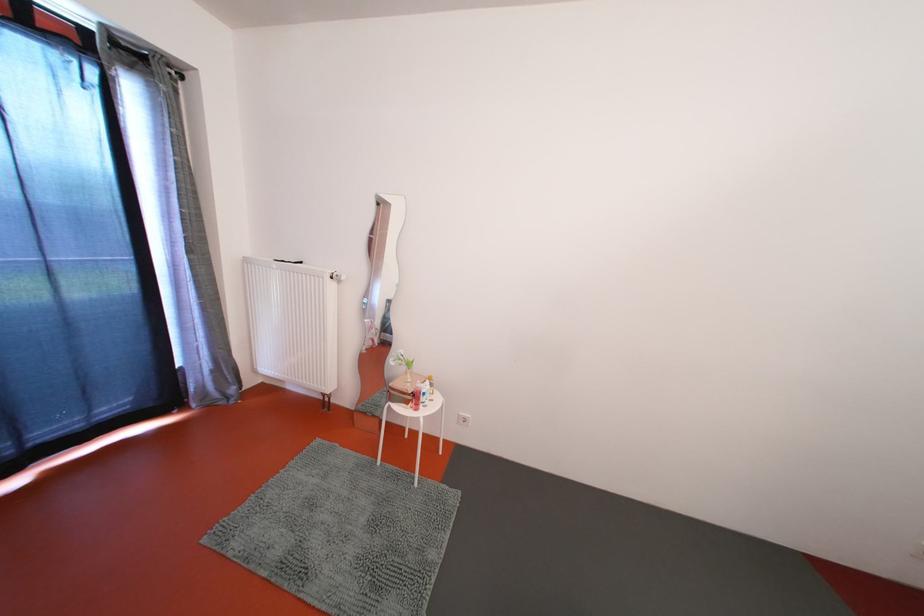
Where would you push the white pump dispenser? Please return your answer as a coordinate pair (x, y).

(293, 323)